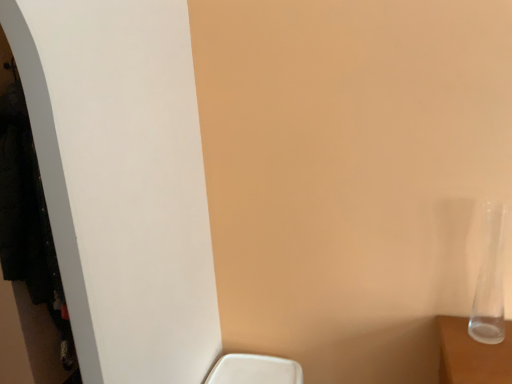
Question: Which is correct: white matte closet at left is inside transparent glass vase at right, or outside of it?

Choices:
 (A) outside
 (B) inside

Answer: (A)

Question: In terms of width, does white matte closet at left look wider or thinner when compared to transparent glass vase at right?

Choices:
 (A) thin
 (B) wide

Answer: (B)

Question: Is white matte closet at left bigger or smaller than transparent glass vase at right?

Choices:
 (A) big
 (B) small

Answer: (A)

Question: In terms of width, does transparent glass vase at right look wider or thinner when compared to white matte closet at left?

Choices:
 (A) thin
 (B) wide

Answer: (A)

Question: Would you say transparent glass vase at right is inside or outside white matte closet at left?

Choices:
 (A) inside
 (B) outside

Answer: (B)

Question: Relative to white matte closet at left, is transparent glass vase at right in front or behind?

Choices:
 (A) front
 (B) behind

Answer: (A)

Question: Considering the positions of point (485, 294) and point (1, 203), is point (485, 294) closer or farther from the camera than point (1, 203)?

Choices:
 (A) farther
 (B) closer

Answer: (B)